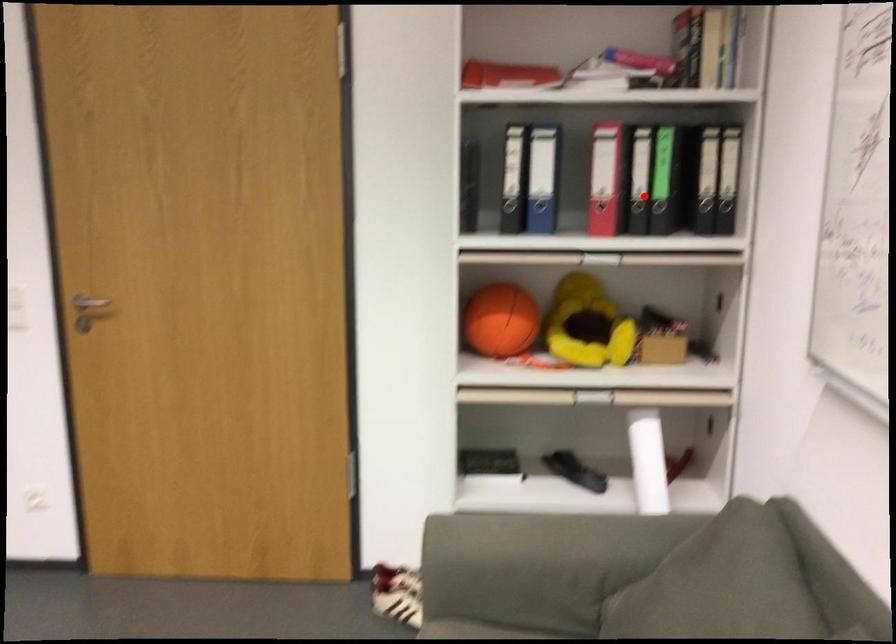
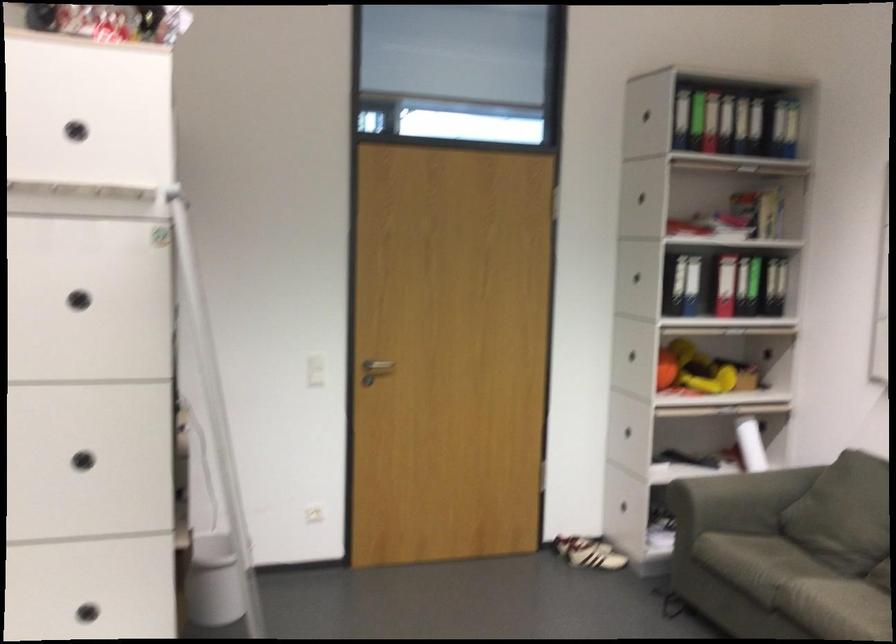
Locate, in the second image, the point that corresponds to the highlighted location in the first image.

(757, 285)